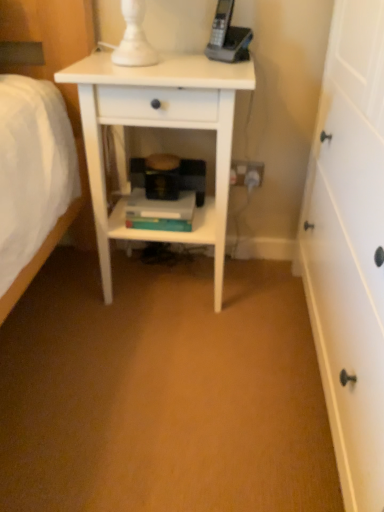
Find the location of a particular element. white plastic electrical outlet at lower center is located at coordinates tap(246, 173).

The image size is (384, 512). I want to click on hardcover books at center, so click(160, 212).

From a real-world perspective, is white plastic electrical outlet at lower center below hardcover books at center?

No.

Is white plastic electrical outlet at lower center not close to hardcover books at center?

No, white plastic electrical outlet at lower center is not far from hardcover books at center.

Find the location of `book on the left side of white plastic electrical outlet at lower center`. book on the left side of white plastic electrical outlet at lower center is located at coordinates (160, 212).

Which is more to the right, white plastic electrical outlet at lower center or hardcover books at center?

white plastic electrical outlet at lower center is more to the right.

From the image's perspective, which one is positioned lower, white matte nightstand at center or white plastic electrical outlet at lower center?

white matte nightstand at center appears lower in the image.

Is white matte nightstand at center turned away from white plastic electrical outlet at lower center?

That's right, white matte nightstand at center is facing away from white plastic electrical outlet at lower center.

Is white matte nightstand at center inside the boundaries of white plastic electrical outlet at lower center, or outside?

white matte nightstand at center is not inside white plastic electrical outlet at lower center, it's outside.

Can you confirm if white matte nightstand at center is bigger than white plastic electrical outlet at lower center?

Indeed, white matte nightstand at center has a larger size compared to white plastic electrical outlet at lower center.

Is hardcover books at center outside of white plastic electrical outlet at lower center?

Yes, hardcover books at center is located beyond the bounds of white plastic electrical outlet at lower center.

Is the depth of hardcover books at center less than that of white plastic electrical outlet at lower center?

Yes, hardcover books at center is closer to the camera.

Would you say hardcover books at center is a long distance from white plastic electrical outlet at lower center?

That's not correct — hardcover books at center is a little close to white plastic electrical outlet at lower center.

Who is bigger, white matte nightstand at center or hardcover books at center?

white matte nightstand at center is bigger.

Which is in front, point (182, 61) or point (141, 192)?

The point (182, 61) is closer.

Between white matte nightstand at center and hardcover books at center, which one has less height?

Answer: With less height is hardcover books at center.

Consider the image. From the image's perspective, which is below, white plastic electrical outlet at lower center or white matte nightstand at center?

white matte nightstand at center, from the image's perspective.

Is white plastic electrical outlet at lower center thinner than white matte nightstand at center?

Indeed, white plastic electrical outlet at lower center has a lesser width compared to white matte nightstand at center.

Is white plastic electrical outlet at lower center directly adjacent to white matte nightstand at center?

white plastic electrical outlet at lower center and white matte nightstand at center are clearly separated.

Is point (136, 206) positioned in front of point (182, 84)?

No, it is behind (182, 84).

Is hardcover books at center turned away from white matte nightstand at center?

Absolutely, hardcover books at center is directed away from white matte nightstand at center.

From the image's perspective, who appears lower, hardcover books at center or white matte nightstand at center?

hardcover books at center.

Find the location of a particular element. electric outlet above the hardcover books at center (from a real-world perspective) is located at coordinates pyautogui.click(x=246, y=173).

What are the coordinates of `nightstand on the left of white plastic electrical outlet at lower center` in the screenshot? It's located at (159, 127).

Looking at the image, which one is located closer to hardcover books at center, white matte nightstand at center or white plastic electrical outlet at lower center?

Among the two, white matte nightstand at center is located nearer to hardcover books at center.

Considering their positions, is hardcover books at center positioned closer to white plastic electrical outlet at lower center than white matte nightstand at center?

hardcover books at center.

Considering their positions, is white plastic electrical outlet at lower center positioned further to hardcover books at center than white matte nightstand at center?

The object further to hardcover books at center is white plastic electrical outlet at lower center.

Based on their spatial positions, is hardcover books at center or white plastic electrical outlet at lower center further from white matte nightstand at center?

white plastic electrical outlet at lower center.

From the image, which object appears to be farther from white matte nightstand at center, white plastic electrical outlet at lower center or hardcover books at center?

white plastic electrical outlet at lower center is further to white matte nightstand at center.

Based on their spatial positions, is white matte nightstand at center or hardcover books at center further from white plastic electrical outlet at lower center?

white matte nightstand at center is positioned further to the anchor white plastic electrical outlet at lower center.

This screenshot has width=384, height=512. Identify the location of book positioned between white matte nightstand at center and white plastic electrical outlet at lower center from near to far. (160, 212).